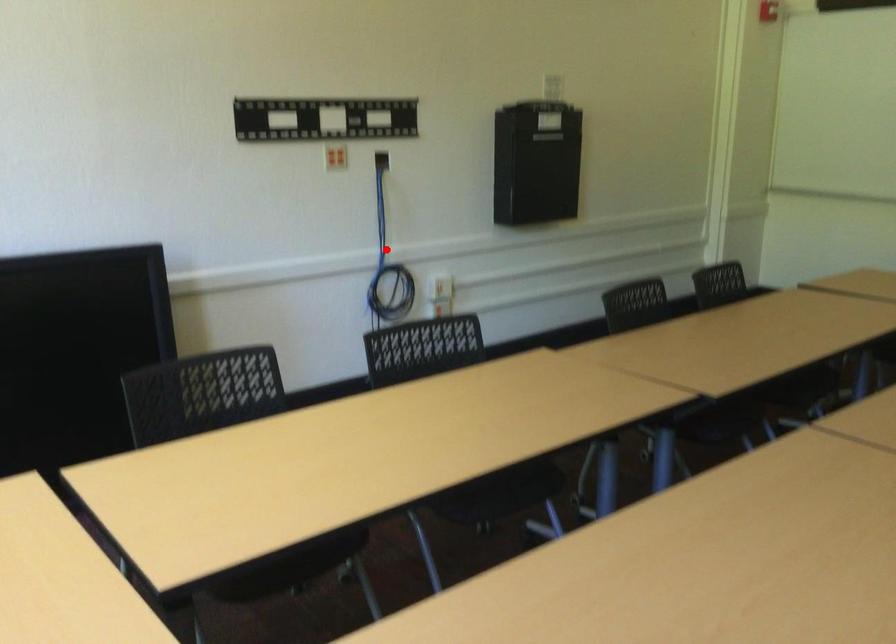
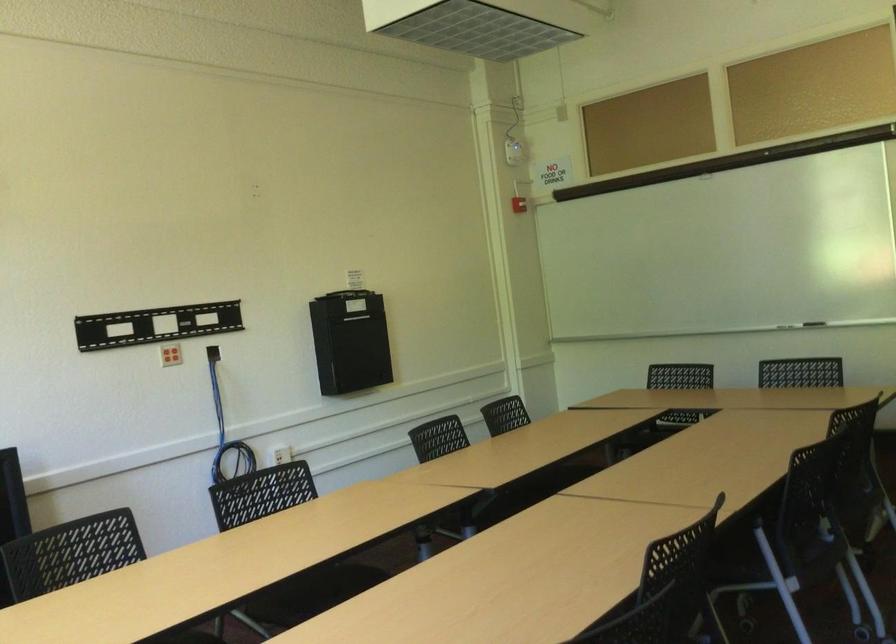
Find the pixel in the second image that matches the highlighted location in the first image.

(226, 431)